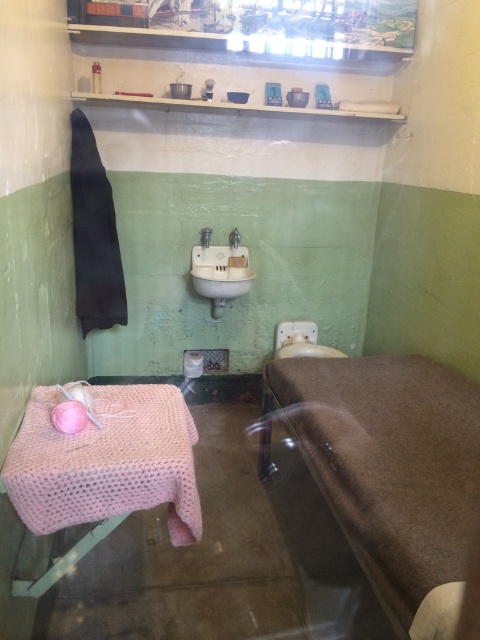
Which is more to the right, pink knitted tablecloth at lower left or satin silver faucet at center?

satin silver faucet at center

Is point (111, 476) positioned behind point (208, 230)?

No, it is not.

Is point (109, 424) positioned before point (206, 237)?

Yes, it is in front of point (206, 237).

Image resolution: width=480 pixels, height=640 pixels. Find the location of `pink knitted tablecloth at lower left`. pink knitted tablecloth at lower left is located at coordinates (107, 461).

Locate an element on the screen. white plastic toilet bowl at center is located at coordinates (300, 340).

Does satin silver faucet at center have a greater height compared to matte white faucet at upper center?

No.

Between satin silver faucet at center and matte white faucet at upper center, which one appears on the left side from the viewer's perspective?

From the viewer's perspective, satin silver faucet at center appears more on the left side.

Does point (202, 234) lie in front of point (231, 234)?

Yes, it is.

You are a GUI agent. You are given a task and a screenshot of the screen. Output one action in this format:
    pyautogui.click(x=<x>, y=<y>)
    Task: Click on the satin silver faucet at center
    This screenshot has width=480, height=640.
    Given the screenshot: What is the action you would take?
    pyautogui.click(x=204, y=236)